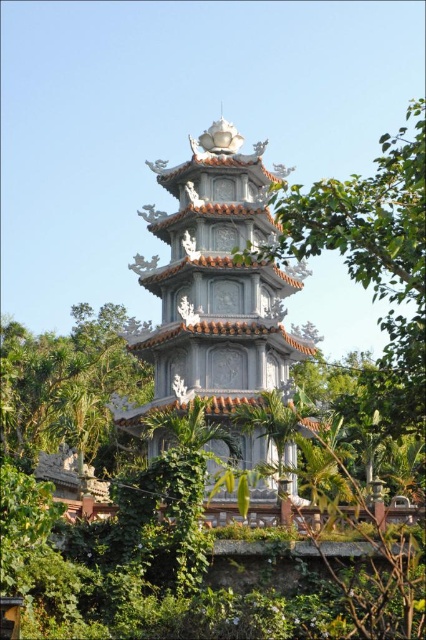
You are standing in front of the pagoda and want to locate two specific points on its structure. The first point is at coordinates point (184, 244) and the second is at point (74, 369). Which of these points is closer to your current position?

Point (184, 244) is closer to the viewer than point (74, 369), so the first point is nearer to your current position.

You are standing in front of the pagoda and see the green leafy tree at center and the green leafy tree at left. Which one is positioned more to the left side of the pagoda?

The green leafy tree at left is positioned more to the left side of the pagoda than the green leafy tree at center.